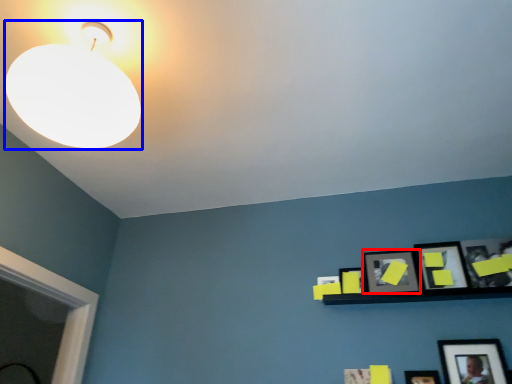
Question: Which point is closer to the camera, picture frame (highlighted by a red box) or lamp (highlighted by a blue box)?

Choices:
 (A) picture frame
 (B) lamp

Answer: (B)